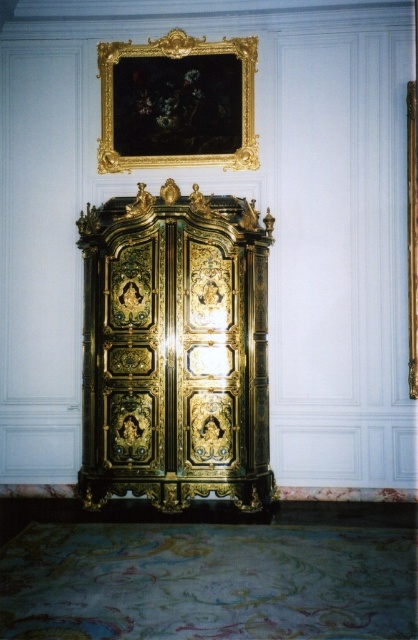
This screenshot has height=640, width=418. Describe the element at coordinates (175, 349) in the screenshot. I see `gold polished wood dresser at center` at that location.

In the scene shown: Who is lower down, gold polished wood dresser at center or gold ornate frame at upper center?

gold polished wood dresser at center is below.

Is point (86, 310) farther from viewer compared to point (171, 58)?

That is False.

This screenshot has height=640, width=418. In order to click on gold polished wood dresser at center in this screenshot , I will do `click(175, 349)`.